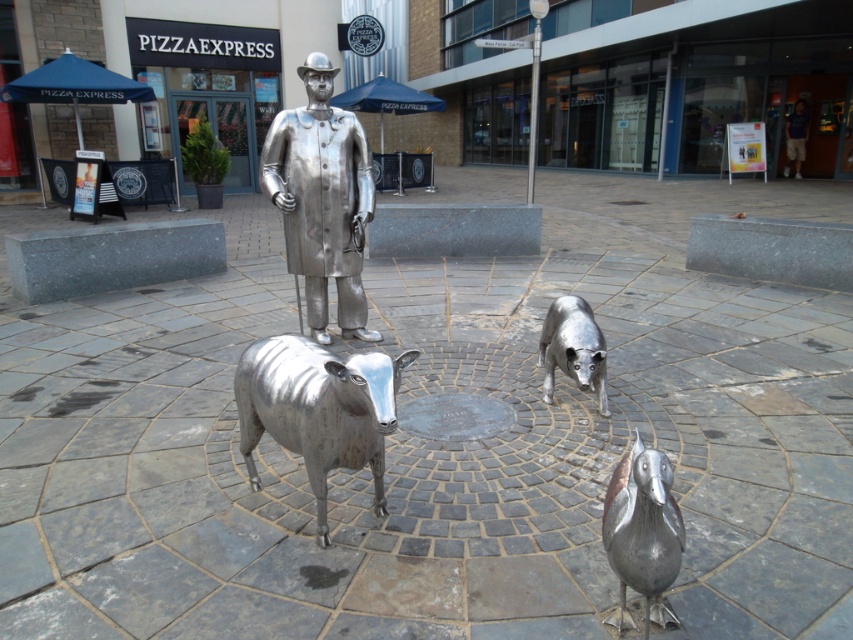
Question: Which object appears farthest from the camera in this image?

Choices:
 (A) polished silver statue at center
 (B) brushed metal sheep at center
 (C) brushed metal dog at center
 (D) brushed metal duck at lower right

Answer: (A)

Question: Which object is the farthest from the brushed metal sheep at center?

Choices:
 (A) brushed metal dog at center
 (B) brushed metal duck at lower right
 (C) polished silver statue at center

Answer: (C)

Question: Does polished silver statue at center have a smaller size compared to brushed metal dog at center?

Choices:
 (A) no
 (B) yes

Answer: (A)

Question: Can you confirm if brushed metal sheep at center is positioned above brushed metal duck at lower right?

Choices:
 (A) yes
 (B) no

Answer: (A)

Question: Which object is farther from the camera taking this photo?

Choices:
 (A) polished silver statue at center
 (B) brushed metal sheep at center
 (C) brushed metal duck at lower right

Answer: (A)

Question: Does brushed metal sheep at center appear under brushed metal duck at lower right?

Choices:
 (A) yes
 (B) no

Answer: (B)